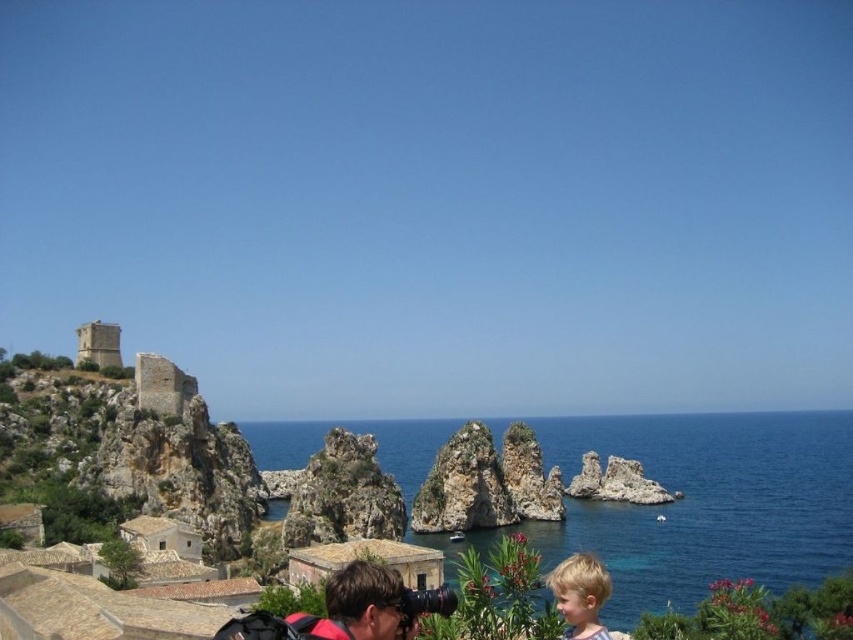
You are standing in the coastal landscape scene. You see the blue water at center and the blonde hair at lower right. Which object is positioned to the right of the other?

The blue water at center is to the right of blonde hair at lower right.

You are a photographer standing at the camera position in the image. You want to capture a closeup shot of the rugged stone rock formation at center. Given that your telephoto lens can focus on subjects up to 100 meters away, will you be able to take the photo without moving closer?

The rugged stone rock formation at center is 106.78 meters away from the camera. Since the telephoto lens can only focus up to 100 meters, you will not be able to take a clear closeup shot without moving closer.

You are a photographer trying to decide whether to place your matte black camera at lower center next to the blonde hair at lower right. Given their sizes, will the camera fit comfortably without overlapping the hair?

The matte black camera at lower center is narrower than the blonde hair at lower right, so it should fit comfortably without overlapping the hair.